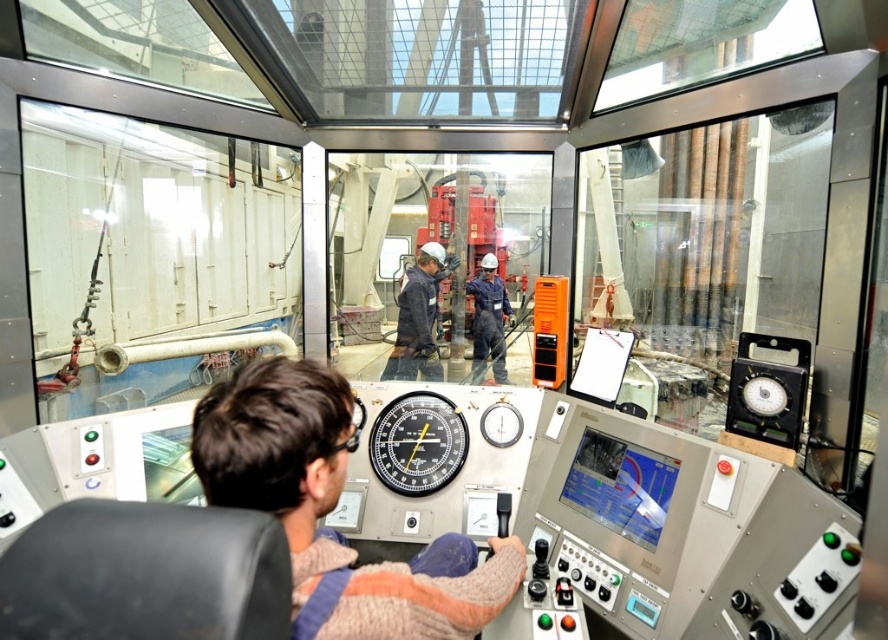
From the picture: You are an inspector in the control room. You need to check the reading on the black plastic gauge at center and ensure the blue uniform at center is properly worn by the operator. Which object should you inspect first if you want to check the gauge without moving your head?

The black plastic gauge at center is located below the blue uniform at center, so you should inspect the blue uniform at center first since it is higher up and closer to your line of sight before looking down to the gauge.

You are an inspector in the control room and need to verify the position of the black plastic gauge at center. However, the knitted sweater at center is blocking your view. Can you see the gauge clearly?

The knitted sweater at center is closer to the viewer than the black plastic gauge at center, so the sweater is blocking the view of the gauge.

You are an engineer in the control room. You need to adjust a control panel setting. The control panel has two points labeled point 1 at coordinates point (410, 360) and point 2 at coordinates point (480, 305). Which point is closer to you?

Point (410, 360) is closer to the viewer than point (480, 305).